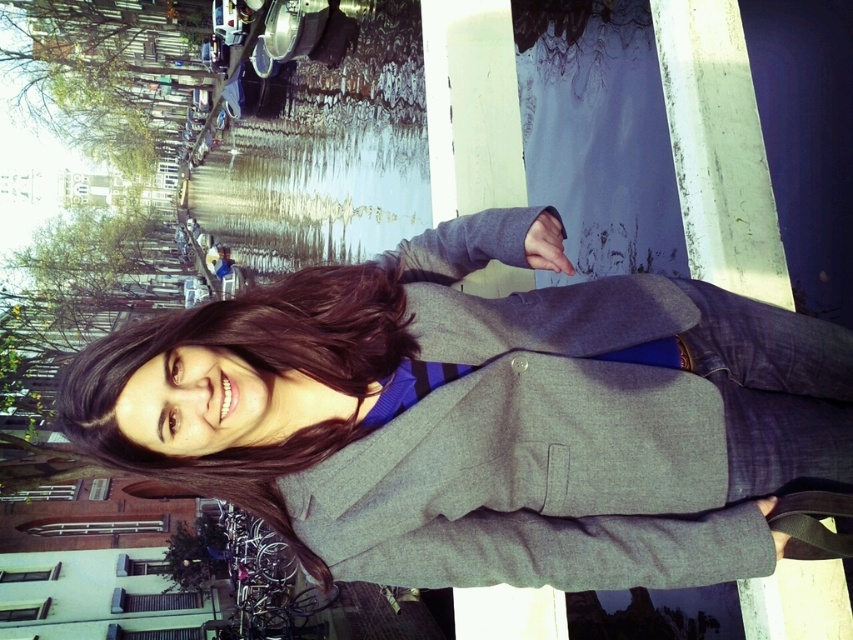
Consider the image. You are a fashion designer observing the person in the image. You need to create a design that complements the gray woolen blazer at center and dark brown hair at center. Considering their sizes, which item should you focus on first to ensure proper proportion?

The gray woolen blazer at center has a greater height compared to dark brown hair at center, so you should focus on designing the gray woolen blazer at center first to ensure proper proportion.

You are a fashion designer observing the person in the image. You need to determine the arrangement of their clothing and hair for a magazine layout. Which item is positioned to the right of the other between the gray woolen blazer at center and the dark brown hair at center?

The gray woolen blazer at center is positioned to the right of the dark brown hair at center.

You are a tailor who needs to determine if the gray woolen blazer at center can fit into a storage box that is 1.2 meters wide. The dark brown hair at center is 0.3 meters wide. Can the blazer fit into the box?

The gray woolen blazer at center is wider than the dark brown hair at center, which is 0.3 meters wide. Since the blazer is wider than 0.3 meters but the storage box is 1.2 meters wide, the blazer can fit into the box as long as its width is less than or equal to 1.2 meters. However, without knowing the exact width of the blazer, we cannot definitively confirm. But since the blazer is only compared to the hair, which is 0.3m, and the box is 1.2m, it is likely the blazer fits unless it exceeds 1.2m.